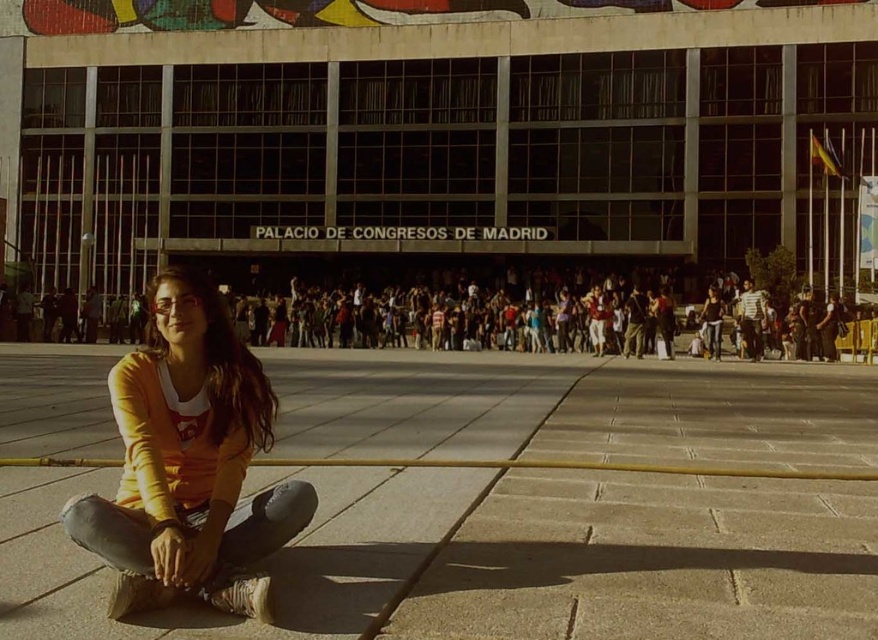
Which is behind, point (281, 620) or point (211, 524)?

Point (211, 524)

Can you confirm if sandy concrete pavement at lower left is smaller than orange cotton shirt at lower left?

Incorrect, sandy concrete pavement at lower left is not smaller in size than orange cotton shirt at lower left.

Is point (549, 540) closer to camera compared to point (186, 410)?

That is False.

Find the location of a particular element. The image size is (878, 640). sandy concrete pavement at lower left is located at coordinates (486, 557).